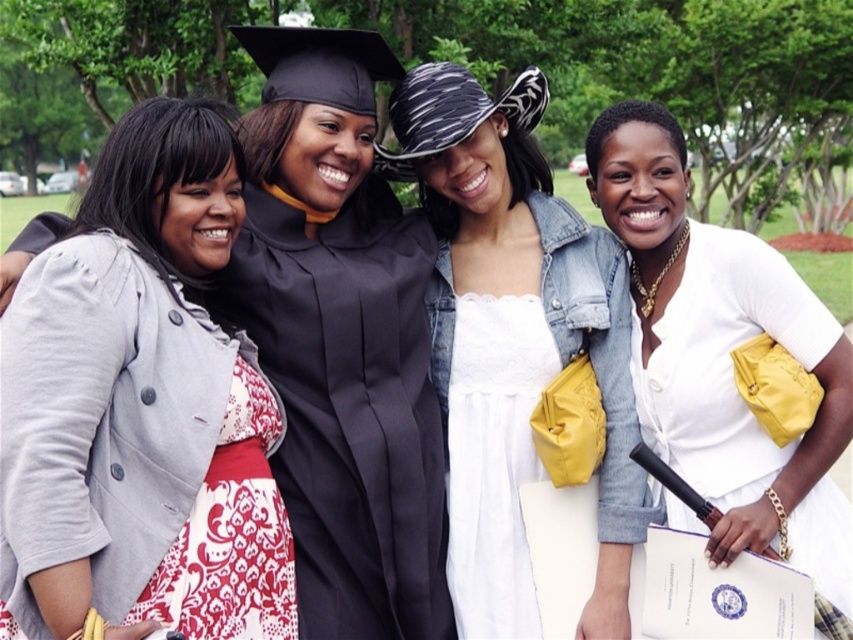
Image resolution: width=853 pixels, height=640 pixels. I want to click on matte gray coat at left, so click(140, 410).

In the scene shown: Can you confirm if matte gray coat at left is positioned to the right of white matte dress at center?

In fact, matte gray coat at left is to the left of white matte dress at center.

Between point (28, 513) and point (645, 260), which one is positioned behind?

Point (645, 260)

You are a GUI agent. You are given a task and a screenshot of the screen. Output one action in this format:
    pyautogui.click(x=<x>, y=<y>)
    Task: Click on the matte gray coat at left
    
    Given the screenshot: What is the action you would take?
    pyautogui.click(x=140, y=410)

Is matte gray coat at left smaller than matte black gown at center?

Indeed, matte gray coat at left has a smaller size compared to matte black gown at center.

Who is more distant from viewer, (3, 528) or (293, 305)?

Positioned behind is point (293, 305).

Where is `matte gray coat at left`? This screenshot has width=853, height=640. matte gray coat at left is located at coordinates (140, 410).

Which of these two, matte black gown at center or white matte dress at center, stands taller?

Standing taller between the two is white matte dress at center.

Between matte black gown at center and white matte dress at center, which one is positioned lower?

matte black gown at center is below.

In the scene shown: Measure the distance between matte black gown at center and camera.

They are 26.87 feet apart.

I want to click on matte black gown at center, so 349,406.